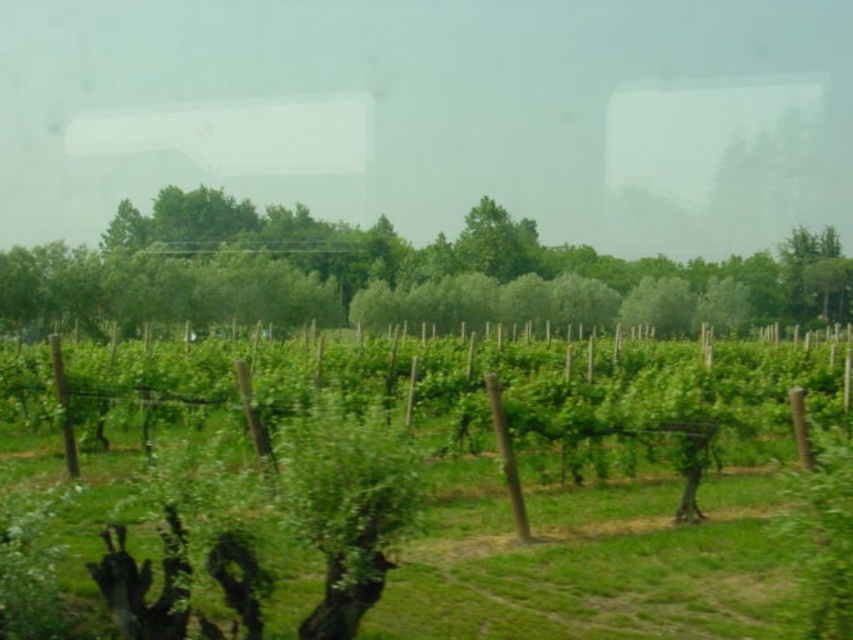
You are an agricultural inspector looking at a vineyard through a window. You notice the green leafy vines at center. Can you determine their exact coordinates in the image?

The green leafy vines at center are located at coordinates point (x=474, y=506).

You are standing in front of the vineyard scene looking through the window. There are two points marked in the image. The first point is at coordinates point (193, 433) and the second point is at point (357, 252). Which point is closer to you?

Point (193, 433) is closer to the camera than point (357, 252).

You are an architect designing a new greenhouse and want to ensure proper sunlight for both the green leafy vines at center and the green leafy tree at center. Based on their heights, which one would require more vertical space in the greenhouse?

The green leafy tree at center requires more vertical space because it is taller than the green leafy vines at center.